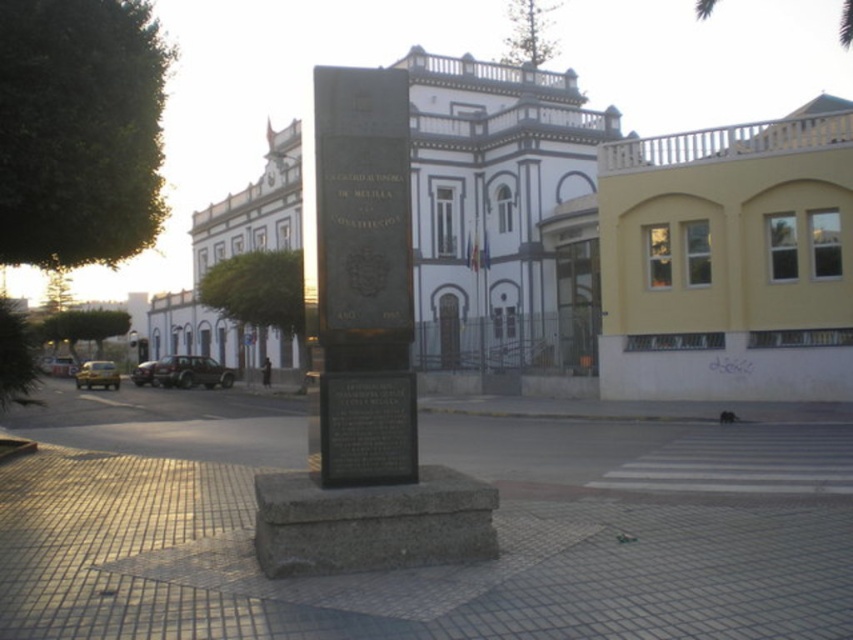
Question: Can you confirm if black granite monument at center is bigger than black stone plaque at center?

Choices:
 (A) yes
 (B) no

Answer: (A)

Question: Can you confirm if black granite monument at center is positioned below green leafy palm tree at upper center?

Choices:
 (A) no
 (B) yes

Answer: (B)

Question: Can you confirm if black granite monument at center is positioned above green leafy palm tree at upper center?

Choices:
 (A) no
 (B) yes

Answer: (A)

Question: Which object is closer to the camera taking this photo?

Choices:
 (A) black granite monument at center
 (B) green leafy palm tree at upper center

Answer: (A)

Question: Among these points, which one is farthest from the camera?

Choices:
 (A) (706, 4)
 (B) (349, 428)
 (C) (366, 528)

Answer: (A)

Question: Among these points, which one is nearest to the camera?

Choices:
 (A) (341, 232)
 (B) (843, 28)
 (C) (401, 472)

Answer: (C)